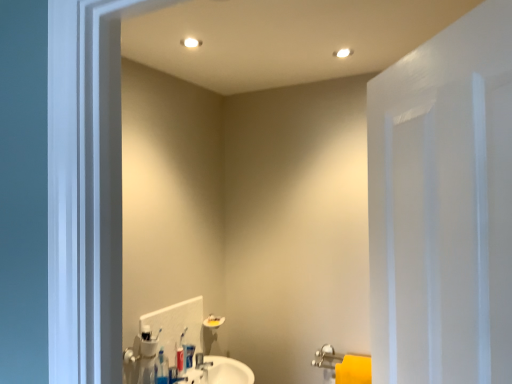
The image size is (512, 384). I want to click on matte plastic toothpaste tube at center, so click(x=189, y=355).

This screenshot has width=512, height=384. Describe the element at coordinates (443, 206) in the screenshot. I see `white painted wood door at right` at that location.

I want to click on white plastic toothbrush at center, so click(x=181, y=354).

Is matte plastic toothpaste tube at center surrounding white painted wood door at right?

No, white painted wood door at right is not surrounded by matte plastic toothpaste tube at center.

Identify the location of toiletry behind the white painted wood door at right. The image size is (512, 384). click(189, 355).

From the image's perspective, would you say matte plastic toothpaste tube at center is shown under white painted wood door at right?

Yes, from the image's perspective, matte plastic toothpaste tube at center is beneath white painted wood door at right.

Is the surface of matte plastic toothpaste tube at center in direct contact with white painted wood door at right?

They are not placed beside each other.

How different are the orientations of white plastic toothbrush at center and matte plastic toothpaste tube at center in degrees?

The angular difference between white plastic toothbrush at center and matte plastic toothpaste tube at center is 4.17 degrees.

Is white plastic toothbrush at center in front of or behind matte plastic toothpaste tube at center in the image?

In the image, white plastic toothbrush at center appears in front of matte plastic toothpaste tube at center.

Between point (178, 349) and point (190, 367), which one is positioned in front?

The point (178, 349) is in front.

Choose the correct answer: Is white plastic toothbrush at center inside matte plastic toothpaste tube at center or outside it?

white plastic toothbrush at center is not enclosed by matte plastic toothpaste tube at center.

Does matte plastic toothpaste tube at center appear on the left side of matte silver faucet at center?

Correct, you'll find matte plastic toothpaste tube at center to the left of matte silver faucet at center.

How distant is matte plastic toothpaste tube at center from matte silver faucet at center?

matte plastic toothpaste tube at center and matte silver faucet at center are 6.79 centimeters apart from each other.

From the picture: Which point is more forward, [194,351] or [204,361]?

Positioned in front is point [194,351].

From a real-world perspective, is matte plastic toothpaste tube at center located beneath matte silver faucet at center?

No, from a real-world perspective, matte plastic toothpaste tube at center is not under matte silver faucet at center.

Visually, is matte silver faucet at center positioned to the left or to the right of matte plastic toothpaste tube at center?

In the image, matte silver faucet at center appears on the right side of matte plastic toothpaste tube at center.

Is matte silver faucet at center oriented away from matte plastic toothpaste tube at center?

No, matte silver faucet at center is not facing away from matte plastic toothpaste tube at center.

Can you confirm if matte silver faucet at center is shorter than matte plastic toothpaste tube at center?

Correct, matte silver faucet at center is not as tall as matte plastic toothpaste tube at center.

Does matte silver faucet at center have a greater width compared to matte plastic toothpaste tube at center?

Indeed, matte silver faucet at center has a greater width compared to matte plastic toothpaste tube at center.

Which point is more distant from viewer, (x=184, y=346) or (x=389, y=253)?

The point (x=184, y=346) is behind.

Is white plastic toothbrush at center to the right of white painted wood door at right from the viewer's perspective?

In fact, white plastic toothbrush at center is to the left of white painted wood door at right.

Between white plastic toothbrush at center and white painted wood door at right, which one has smaller size?

With smaller size is white plastic toothbrush at center.

Which is correct: white plastic toothbrush at center is inside white painted wood door at right, or outside of it?

The correct answer is: outside.

Would you say white plastic toothbrush at center contains matte silver faucet at center?

No.

From the image's perspective, is white plastic toothbrush at center on matte silver faucet at center?

Yes, from the image's perspective, white plastic toothbrush at center is over matte silver faucet at center.

Considering the sizes of objects white plastic toothbrush at center and matte silver faucet at center in the image provided, who is thinner, white plastic toothbrush at center or matte silver faucet at center?

With smaller width is white plastic toothbrush at center.

From the image's perspective, which is below, white painted wood door at right or matte plastic toothpaste tube at center?

matte plastic toothpaste tube at center appears lower in the image.

Based on their positions, is white painted wood door at right located to the left or right of matte plastic toothpaste tube at center?

Based on their positions, white painted wood door at right is located to the right of matte plastic toothpaste tube at center.

Find the location of `toiletry located below the white painted wood door at right (from the image's perspective)`. toiletry located below the white painted wood door at right (from the image's perspective) is located at coordinates (189, 355).

In the image, there is a matte plastic toothpaste tube at center. At what (x,y) coordinates should I click in order to perform the action: click on door above it (from the image's perspective). Please return your answer as a coordinate pair (x, y). Looking at the image, I should click on (443, 206).

Find the location of `toiletry below the white plastic toothbrush at center (from the image's perspective)`. toiletry below the white plastic toothbrush at center (from the image's perspective) is located at coordinates (189, 355).

From the image, which object appears to be farther from white plastic toothbrush at center, white painted wood door at right or matte silver faucet at center?

Among the two, white painted wood door at right is located further to white plastic toothbrush at center.

When comparing their distances from white plastic toothbrush at center, does white painted wood door at right or matte plastic toothpaste tube at center seem further?

white painted wood door at right is positioned further to the anchor white plastic toothbrush at center.

Which object lies further to the anchor point white painted wood door at right, matte plastic toothpaste tube at center or matte silver faucet at center?

matte silver faucet at center is positioned further to the anchor white painted wood door at right.

Looking at the image, which one is located further to white painted wood door at right, matte plastic toothpaste tube at center or white plastic toothbrush at center?

The object further to white painted wood door at right is matte plastic toothpaste tube at center.

Which object lies further to the anchor point white painted wood door at right, matte silver faucet at center or matte plastic toothpaste tube at center?

Among the two, matte silver faucet at center is located further to white painted wood door at right.

Based on their spatial positions, is white plastic toothbrush at center or white painted wood door at right further from matte plastic toothpaste tube at center?

white painted wood door at right is positioned further to the anchor matte plastic toothpaste tube at center.

When comparing their distances from white plastic toothbrush at center, does matte plastic toothpaste tube at center or white painted wood door at right seem closer?

Based on the image, matte plastic toothpaste tube at center appears to be nearer to white plastic toothbrush at center.

When comparing their distances from white painted wood door at right, does white plastic toothbrush at center or matte plastic toothpaste tube at center seem closer?

white plastic toothbrush at center is closer to white painted wood door at right.

Where is `toothbrush located between white painted wood door at right and matte silver faucet at center in the depth direction`? This screenshot has width=512, height=384. toothbrush located between white painted wood door at right and matte silver faucet at center in the depth direction is located at coordinates (181, 354).

Locate an element on the screen. toothbrush between white painted wood door at right and matte plastic toothpaste tube at center along the z-axis is located at coordinates (181, 354).

Find the location of `toiletry between white plastic toothbrush at center and matte silver faucet at center in the front-back direction`. toiletry between white plastic toothbrush at center and matte silver faucet at center in the front-back direction is located at coordinates (189, 355).

Find the location of a particular element. The width and height of the screenshot is (512, 384). toiletry positioned between white painted wood door at right and matte silver faucet at center from near to far is located at coordinates (189, 355).